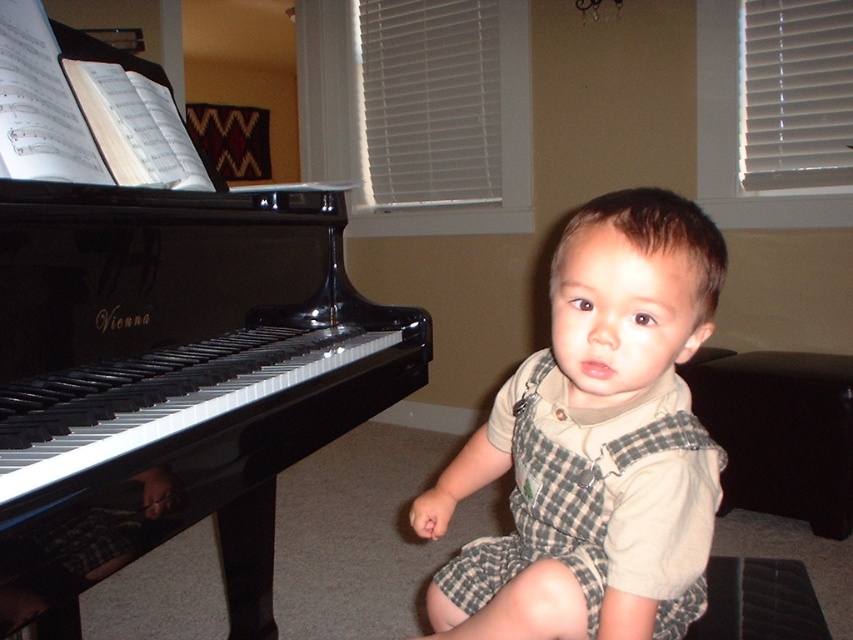
You are standing in front of the grand piano and want to place a small sticker on the piano. There are two points on the piano where you can choose to place it. The first point is at coordinates point (242, 592) and the second point is at coordinates point (561, 561). Which point is closer to you, so the sticker will be more visible?

Point (242, 592) is closer to you than point (561, 561) because it is further to the camera. Therefore, placing the sticker at point (242, 592) will make it more visible.

You are a photographer standing at the center of the room. You want to take a photo of the black glossy piano at left. Which direction should you move to get a better angle?

The black glossy piano at left is located at point (x=166, y=348). Since you are at the center, you should move to the left to align with the piano for a better angle.

The child is wearing light beige plaid overalls at center. The child wants to place a small toy on the floor between themselves and the piano. The toy is 10 inches long. Is there enough space between the child and the piano for the toy?

The distance between the child and the piano is 26.58 inches. Since the toy is only 10 inches long, there is sufficient space for the toy to fit between the child and the piano.